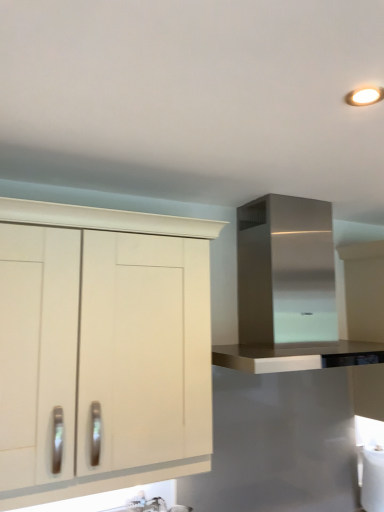
This screenshot has height=512, width=384. I want to click on vacant space situated above stainless steel range hood at upper right, placed as the 2th cabinetry when sorted from left to right (from a real-world perspective), so click(311, 199).